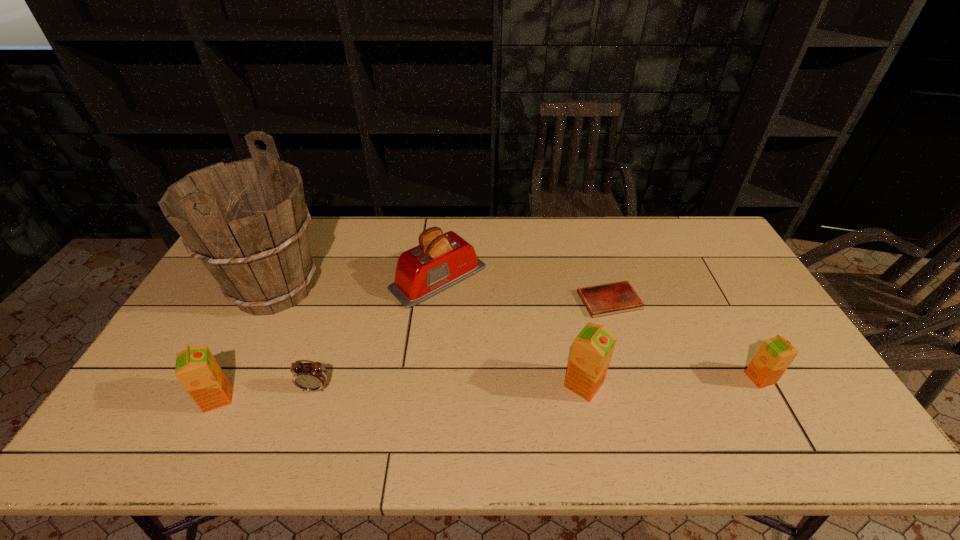
Where is `the leftmost orange juice`? the leftmost orange juice is located at coordinates (196, 368).

The image size is (960, 540). I want to click on the second orange juice from right to left, so click(x=592, y=349).

The image size is (960, 540). I want to click on the rightmost orange juice, so click(x=775, y=355).

Locate an element on the screen. the rightmost object is located at coordinates (775, 355).

Find the location of a particular element. The height and width of the screenshot is (540, 960). the shortest object is located at coordinates (602, 300).

I want to click on bucket, so click(x=247, y=221).

Image resolution: width=960 pixels, height=540 pixels. Find the location of `the fourth object from left to right`. the fourth object from left to right is located at coordinates (440, 261).

The width and height of the screenshot is (960, 540). In order to click on the third object from left to right in this screenshot , I will do `click(312, 376)`.

Where is `the second shortest object`? Image resolution: width=960 pixels, height=540 pixels. the second shortest object is located at coordinates (312, 376).

Locate an element on the screen. The height and width of the screenshot is (540, 960). free space located on the back of the second tallest orange juice is located at coordinates (267, 299).